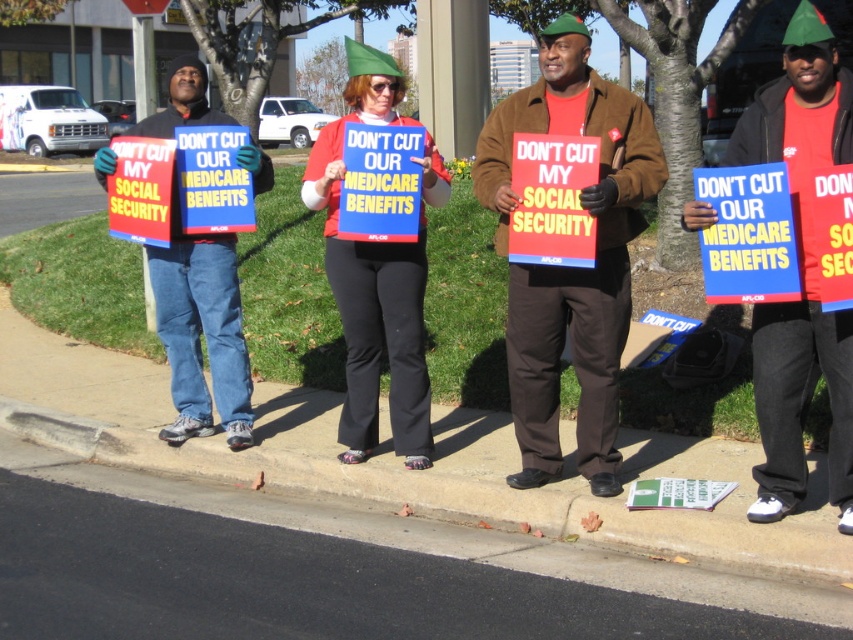
Question: Is matte brown jacket at center above matte red sign at center?

Choices:
 (A) yes
 (B) no

Answer: (B)

Question: Is matte brown jacket at center bigger than denim jeans at left?

Choices:
 (A) no
 (B) yes

Answer: (B)

Question: Which point is farther to the camera?

Choices:
 (A) (225, 397)
 (B) (567, 296)
 (C) (753, 504)
 (D) (358, 353)

Answer: (A)

Question: Considering the relative positions of matte brown jacket at center and concrete at lower left in the image provided, where is matte brown jacket at center located with respect to concrete at lower left?

Choices:
 (A) left
 (B) right

Answer: (B)

Question: Which object is the farthest from the matte red sign at center?

Choices:
 (A) denim jeans at left
 (B) concrete at lower left
 (C) matte brown jacket at center
 (D) red fabric sign at center

Answer: (D)

Question: Estimate the real-world distances between objects in this image. Which object is closer to the denim jeans at left?

Choices:
 (A) concrete at lower left
 (B) matte brown jacket at center
 (C) matte red sign at center

Answer: (A)